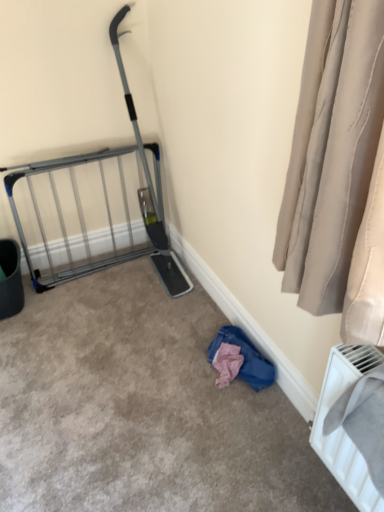
Question: Should I look upward or downward to see pink fabric at lower right?

Choices:
 (A) up
 (B) down

Answer: (B)

Question: Is pink fabric at lower right positioned with its back to white plastic radiator at lower right?

Choices:
 (A) no
 (B) yes

Answer: (A)

Question: Is pink fabric at lower right behind white plastic radiator at lower right?

Choices:
 (A) no
 (B) yes

Answer: (B)

Question: Does pink fabric at lower right have a greater width compared to white plastic radiator at lower right?

Choices:
 (A) yes
 (B) no

Answer: (A)

Question: Can you confirm if pink fabric at lower right is smaller than white plastic radiator at lower right?

Choices:
 (A) yes
 (B) no

Answer: (A)

Question: Are pink fabric at lower right and white plastic radiator at lower right located far from each other?

Choices:
 (A) no
 (B) yes

Answer: (A)

Question: Does pink fabric at lower right have a greater height compared to white plastic radiator at lower right?

Choices:
 (A) no
 (B) yes

Answer: (A)

Question: Does pink fabric at lower right have a greater height compared to silver metallic gate at left?

Choices:
 (A) no
 (B) yes

Answer: (A)

Question: From the image's perspective, would you say pink fabric at lower right is positioned over silver metallic gate at left?

Choices:
 (A) yes
 (B) no

Answer: (B)

Question: Does pink fabric at lower right appear on the left side of silver metallic gate at left?

Choices:
 (A) yes
 (B) no

Answer: (B)

Question: Does pink fabric at lower right come behind silver metallic gate at left?

Choices:
 (A) no
 (B) yes

Answer: (A)

Question: Can you confirm if pink fabric at lower right is positioned to the right of silver metallic gate at left?

Choices:
 (A) no
 (B) yes

Answer: (B)

Question: Is pink fabric at lower right positioned in front of silver metallic gate at left?

Choices:
 (A) yes
 (B) no

Answer: (A)

Question: From the image's perspective, is white plastic radiator at lower right below silver metallic gate at left?

Choices:
 (A) yes
 (B) no

Answer: (A)